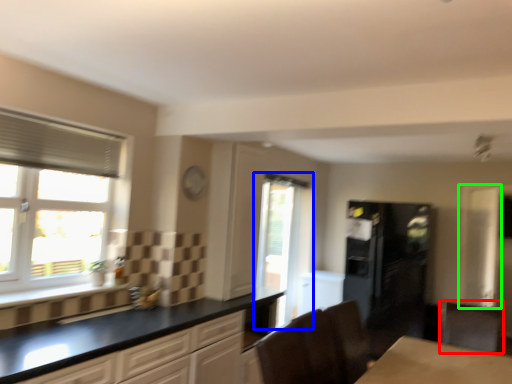
Question: Based on their relative distances, which object is nearer to cabinetry (highlighted by a red box)? Choose from window (highlighted by a blue box) and screen door (highlighted by a green box).

Choices:
 (A) window
 (B) screen door

Answer: (B)